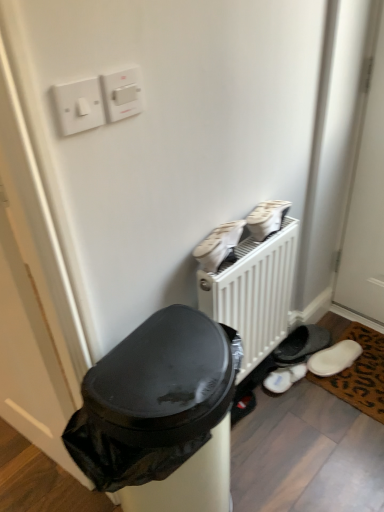
Question: Is brown leopard print mat at lower right in front of or behind white fluffy slippers at lower right, which is the third footwear from front to back, in the image?

Choices:
 (A) front
 (B) behind

Answer: (A)

Question: From the image's perspective, is brown leopard print mat at lower right positioned above or below white fluffy slippers at lower right, the first footwear in the back-to-front sequence?

Choices:
 (A) above
 (B) below

Answer: (A)

Question: Estimate the real-world distances between objects in this image. Which object is farther from the brown leopard print mat at lower right?

Choices:
 (A) white plastic light switch at upper left, which appears as the 1th light switch when viewed from the left
 (B) white fabric shoes at upper right, positioned as the 2th footwear in front-to-back order
 (C) black plastic trash can at lower left
 (D) white plastic light switch at upper center, the 1th light switch viewed from the right
 (E) white matte radiator at center

Answer: (A)

Question: Which object is positioned farthest from the white fabric shoes at center, the third footwear positioned from the back?

Choices:
 (A) white fabric shoes at upper right, placed as the 2th footwear when sorted from back to front
 (B) black plastic trash can at lower left
 (C) white plastic light switch at upper left, which appears as the 1th light switch when viewed from the left
 (D) white plastic light switch at upper center, the 1th light switch viewed from the right
 (E) brown leopard print mat at lower right

Answer: (E)